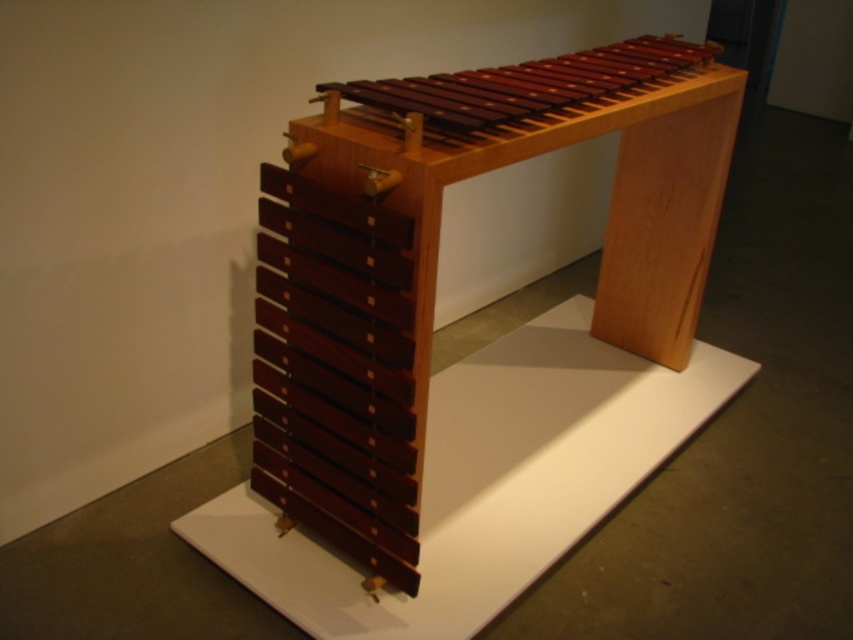
Based on the photo, you are a visitor standing in front of the mahogany wood xylophone at center in the museum. You want to take a photo of it without getting too close. The museum allows photos but requires visitors to stay at least 3 feet away from the exhibit. Can you safely take your photo from your current position?

The mahogany wood xylophone at center and viewer are 3.90 feet apart from each other. Since 3.90 feet is more than the required 3 feet distance, you can safely take the photo from your current position without violating the museum rules.

You are standing in an art gallery and see a wooden musical instrument displayed. There is a point marked at coordinates (437, 253). Can you identify which object this point is pointing to?

The point at coordinates (437, 253) corresponds to the mahogany wood xylophone at center.

You are a museum curator planning to move the mahogany wood xylophone at center and the polished wood xylophone at center into a new exhibition space. The entrance door to this space has a height restriction of 1.8 meters. Can both instruments be moved through the door without being disassembled?

The mahogany wood xylophone at center is taller than the polished wood xylophone at center. Since the entrance door has a height restriction of 1.8 meters, we need to know the exact height of the taller instrument. However, the description only states their relative heights. Without specific measurements, it is impossible to determine if both can pass through the door. Additional information about their actual heights is required.